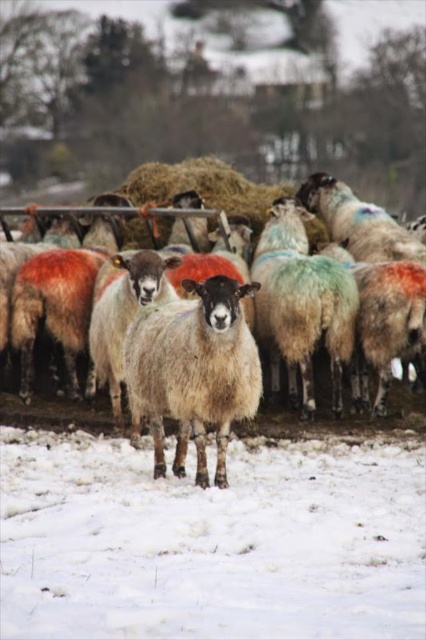
Can you confirm if fuzzy woolly sheep at center is smaller than fuzzy woolen sheep at center?

No.

Is point (219, 289) closer to viewer compared to point (88, 412)?

Yes, point (219, 289) is closer to viewer.

You are a GUI agent. You are given a task and a screenshot of the screen. Output one action in this format:
    pyautogui.click(x=<x>, y=<y>)
    Task: Click on the fuzzy woolly sheep at center
    The width and height of the screenshot is (426, 640).
    Given the screenshot: What is the action you would take?
    pyautogui.click(x=193, y=371)

Which is above, fuzzy woolly sheep at center or white woolen sheep at center?

white woolen sheep at center

Which is behind, point (155, 476) or point (293, 227)?

The point (293, 227) is behind.

Find the location of a particular element. fuzzy woolly sheep at center is located at coordinates (193, 371).

Can you confirm if white woolen sheep at center is positioned below fuzzy woolen sheep at center?

Actually, white woolen sheep at center is above fuzzy woolen sheep at center.

Is white woolen sheep at center closer to camera compared to fuzzy woolen sheep at center?

That is False.

Is point (305, 234) positioned after point (183, 262)?

Yes, it is behind point (183, 262).

Locate an element on the screen. This screenshot has width=426, height=640. white woolen sheep at center is located at coordinates (302, 304).